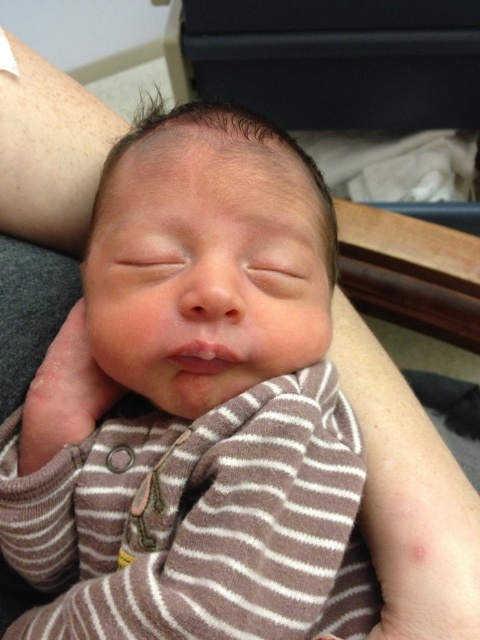
Question: Which of the following is the farthest from the observer?

Choices:
 (A) (404, 406)
 (B) (305, 289)

Answer: (A)

Question: Does brown striped onesie at center have a larger size compared to smooth skin at lower right?

Choices:
 (A) no
 (B) yes

Answer: (B)

Question: Among these objects, which one is farthest from the camera?

Choices:
 (A) brown striped onesie at center
 (B) smooth skin at lower right

Answer: (B)

Question: From the image, what is the correct spatial relationship of brown striped onesie at center in relation to smooth skin at lower right?

Choices:
 (A) below
 (B) above

Answer: (B)

Question: Does brown striped onesie at center appear on the left side of smooth skin at lower right?

Choices:
 (A) yes
 (B) no

Answer: (A)

Question: Which of the following is the closest to the observer?

Choices:
 (A) smooth skin at lower right
 (B) brown striped onesie at center

Answer: (B)